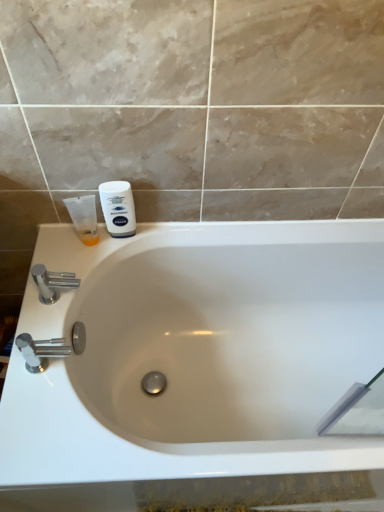
Find the location of a particular element. This screenshot has width=384, height=512. free space to the left of white matte shaving cream at upper left, arranged as the first shaving cream when viewed from the right is located at coordinates (69, 253).